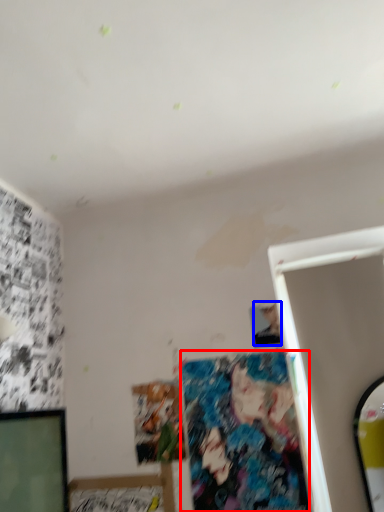
Question: Which of the following is the closest to the observer, art (highlighted by a red box) or person (highlighted by a blue box)?

Choices:
 (A) art
 (B) person

Answer: (A)